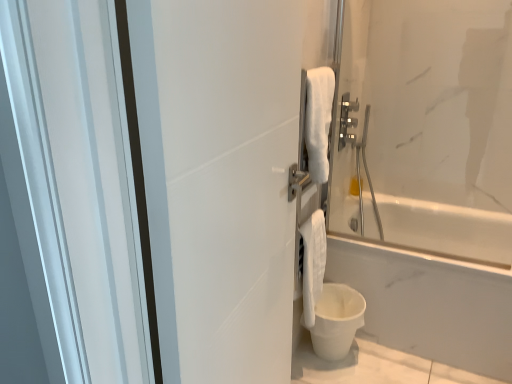
What are the coordinates of `vacant point to the right of white matte bucket at lower right` in the screenshot? It's located at (385, 359).